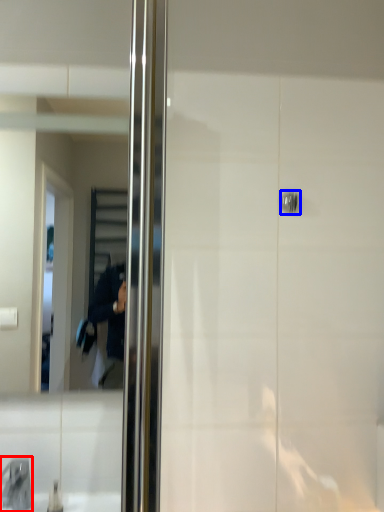
Question: Among these objects, which one is farthest to the camera, faucet (highlighted by a red box) or door handle (highlighted by a blue box)?

Choices:
 (A) faucet
 (B) door handle

Answer: (B)